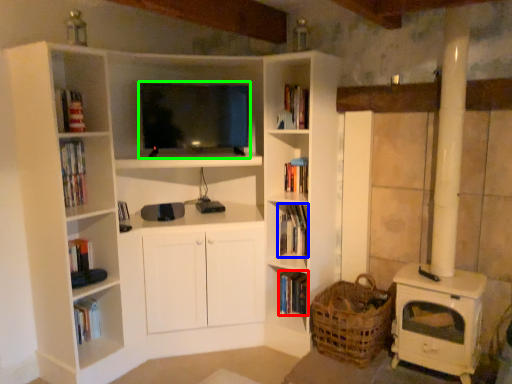
Question: Which is farther away from book (highlighted by a red box)? book (highlighted by a blue box) or television (highlighted by a green box)?

Choices:
 (A) book
 (B) television

Answer: (B)